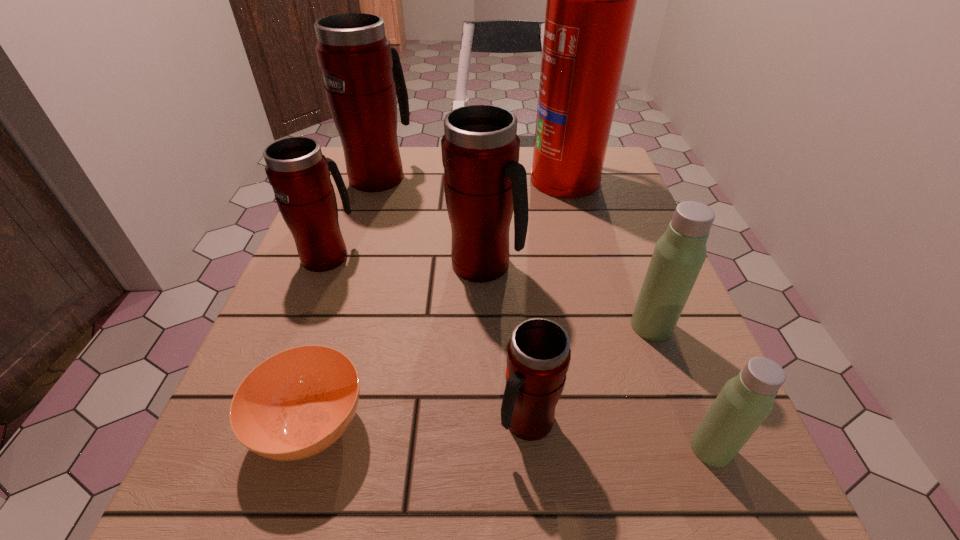
The height and width of the screenshot is (540, 960). I want to click on red thermos bottle object that ranks as the second closest to the farthest thermos bottle, so click(484, 182).

Find the location of a particular element. The image size is (960, 540). red thermos bottle that is the third nearest to the third tallest object is located at coordinates (538, 355).

Locate an element on the screen. This screenshot has width=960, height=540. free region that satisfies the following two spatial constraints: 1. on the side with the handle of the nearer light thermos bottle; 2. on the left side of the smallest red thermos bottle is located at coordinates (530, 448).

Image resolution: width=960 pixels, height=540 pixels. In order to click on free space in the image that satisfies the following two spatial constraints: 1. on the instruction side of the nearer light thermos bottle; 2. on the right side of the red fire extinguisher in this screenshot , I will do `click(637, 448)`.

This screenshot has width=960, height=540. I want to click on vacant area in the image that satisfies the following two spatial constraints: 1. on the back side of the smaller light thermos bottle; 2. on the instruction side of the red fire extinguisher, so click(604, 177).

You are a GUI agent. You are given a task and a screenshot of the screen. Output one action in this format:
    pyautogui.click(x=<x>, y=<y>)
    Task: Click on the free spot that satisfies the following two spatial constraints: 1. on the instruction side of the red fire extinguisher; 2. on the right side of the nearer light thermos bottle
    Image resolution: width=960 pixels, height=540 pixels.
    Given the screenshot: What is the action you would take?
    pyautogui.click(x=637, y=448)